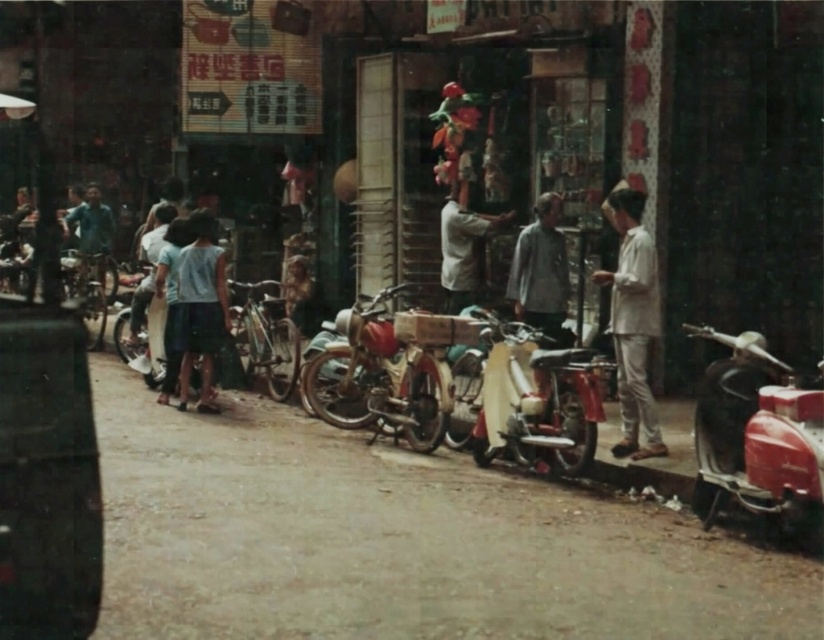
Locate an element on the screen. This screenshot has width=824, height=640. shiny red scooter at right is located at coordinates (757, 438).

Can you confirm if shiny red scooter at right is positioned to the right of light brown fabric shirt at center?

Indeed, shiny red scooter at right is positioned on the right side of light brown fabric shirt at center.

Locate an element on the screen. shiny red scooter at right is located at coordinates (757, 438).

Is shiny red motorcycle at center shorter than white cotton shirt at right?

Yes.

Measure the distance between point (x=574, y=380) and camera.

Point (x=574, y=380) is 27.75 feet away from camera.

Identify the location of shiny red motorcycle at center. This screenshot has height=640, width=824. [x=535, y=397].

Does shiny red motorcycle at center appear on the right side of shiny metallic bicycle at center-left?

Indeed, shiny red motorcycle at center is positioned on the right side of shiny metallic bicycle at center-left.

Is shiny red motorcycle at center bigger than shiny metallic bicycle at center-left?

Incorrect, shiny red motorcycle at center is not larger than shiny metallic bicycle at center-left.

Between point (528, 326) and point (272, 307), which one is positioned in front?

Positioned in front is point (528, 326).

Image resolution: width=824 pixels, height=640 pixels. I want to click on shiny red motorcycle at center, so click(535, 397).